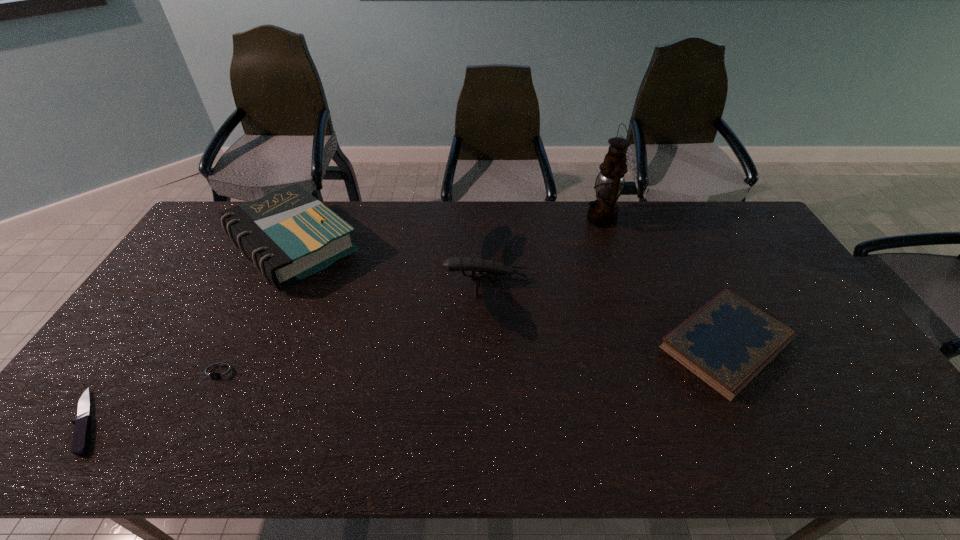
Find the location of a particular element. Image resolution: width=960 pixels, height=540 pixels. empty space between the steak knife and the right paperback book is located at coordinates (407, 382).

Locate an element on the screen. The height and width of the screenshot is (540, 960). free space between the left paperback book and the shortest object is located at coordinates (190, 334).

Locate an element on the screen. object that stands as the closest to the taller paperback book is located at coordinates (222, 372).

Locate which object is the fourth closest to the watch. Please provide its 2D coordinates. Your answer should be formatted as a tuple, i.e. [(x, y)], where the tuple contains the x and y coordinates of a point satisfying the conditions above.

[(726, 343)]

What are the coordinates of `vacant position in the image that satisfies the following two spatial constraints: 1. at the head of the drone; 2. on the face of the second shortest object` in the screenshot? It's located at (488, 373).

Image resolution: width=960 pixels, height=540 pixels. Find the location of `free point that satisfies the following two spatial constraints: 1. at the head of the fourth object from left to right; 2. on the back side of the right paperback book`. free point that satisfies the following two spatial constraints: 1. at the head of the fourth object from left to right; 2. on the back side of the right paperback book is located at coordinates click(487, 343).

Locate an element on the screen. This screenshot has height=540, width=960. free space that satisfies the following two spatial constraints: 1. at the head of the fourth object from left to right; 2. on the front side of the steak knife is located at coordinates (488, 421).